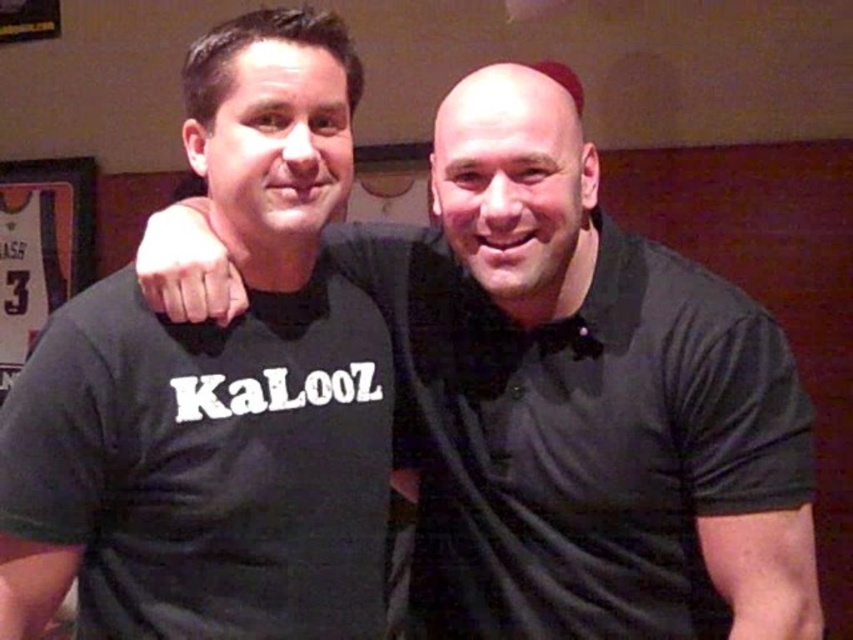
Question: Considering the real-world distances, which object is closest to the black cotton polo shirt at right?

Choices:
 (A) black matte t-shirt at left
 (B) black matte shirt at center

Answer: (B)

Question: Which point is closer to the camera?

Choices:
 (A) (190, 387)
 (B) (422, 422)
 (C) (451, 424)

Answer: (A)

Question: Can you confirm if black matte shirt at center is smaller than black cotton polo shirt at right?

Choices:
 (A) no
 (B) yes

Answer: (A)

Question: Is black matte shirt at center wider than black cotton polo shirt at right?

Choices:
 (A) no
 (B) yes

Answer: (B)

Question: Among these objects, which one is nearest to the camera?

Choices:
 (A) black matte t-shirt at left
 (B) black cotton polo shirt at right
 (C) black matte shirt at center

Answer: (A)

Question: Is black matte shirt at center closer to the viewer compared to black matte t-shirt at left?

Choices:
 (A) yes
 (B) no

Answer: (B)